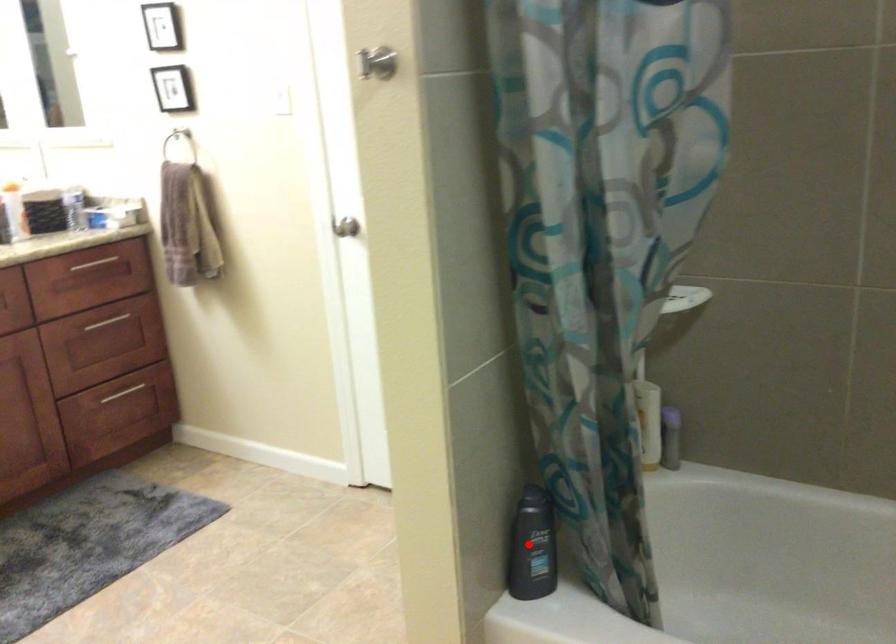
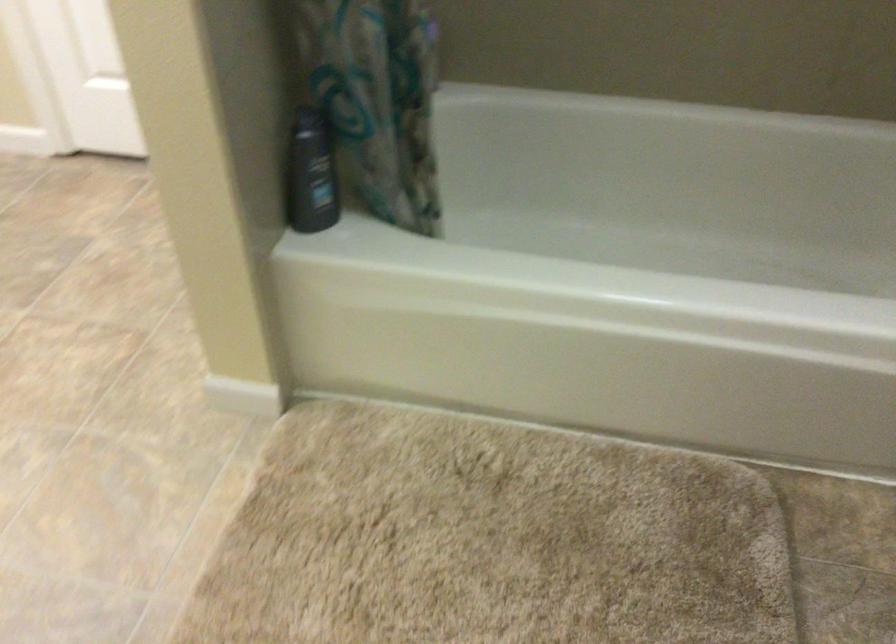
Locate, in the second image, the point that corresponds to the highlighted location in the first image.

(311, 174)